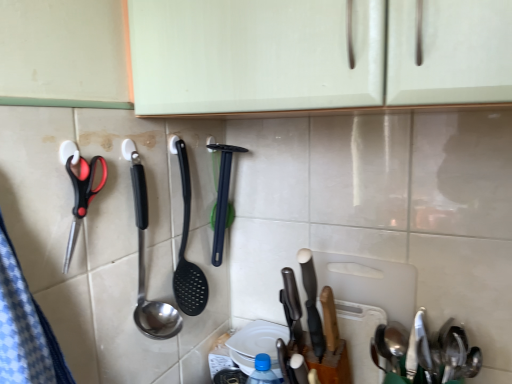
Question: From a real-world perspective, is white matte cutting board at center-right below polished stainless steel spoon at center, the second spoon from the bottom?

Choices:
 (A) yes
 (B) no

Answer: (A)

Question: Is white matte cutting board at center-right in contact with polished stainless steel spoon at center, positioned as the 2th spoon in right-to-left order?

Choices:
 (A) no
 (B) yes

Answer: (A)

Question: Can you confirm if white matte cutting board at center-right is wider than polished stainless steel spoon at center, positioned as the 2th spoon in right-to-left order?

Choices:
 (A) yes
 (B) no

Answer: (B)

Question: Is white matte cutting board at center-right oriented away from polished stainless steel spoon at center, which is counted as the first spoon, starting from the left?

Choices:
 (A) yes
 (B) no

Answer: (B)

Question: Is white matte cutting board at center-right at the left side of polished stainless steel spoon at center, the second spoon from the bottom?

Choices:
 (A) no
 (B) yes

Answer: (A)

Question: Is white matte cutting board at center-right positioned in front of polished stainless steel spoon at center, positioned as the 2th spoon in right-to-left order?

Choices:
 (A) yes
 (B) no

Answer: (B)

Question: Considering the relative sizes of black plastic spatula at center and white matte cutting board at center-right in the image provided, is black plastic spatula at center thinner than white matte cutting board at center-right?

Choices:
 (A) no
 (B) yes

Answer: (A)

Question: Does black plastic spatula at center lie in front of white matte cutting board at center-right?

Choices:
 (A) no
 (B) yes

Answer: (A)

Question: Is white matte cutting board at center-right inside black plastic spatula at center?

Choices:
 (A) no
 (B) yes

Answer: (A)

Question: From the image's perspective, is black plastic spatula at center over white matte cutting board at center-right?

Choices:
 (A) yes
 (B) no

Answer: (A)

Question: From a real-world perspective, does black plastic spatula at center sit lower than white matte cutting board at center-right?

Choices:
 (A) no
 (B) yes

Answer: (A)

Question: Can you confirm if black plastic spatula at center is taller than white matte cutting board at center-right?

Choices:
 (A) yes
 (B) no

Answer: (B)

Question: From a real-world perspective, is black plastic spatula at center physically above satin silver spoon at lower right, which appears as the first spoon when ordered from the bottom?

Choices:
 (A) no
 (B) yes

Answer: (B)